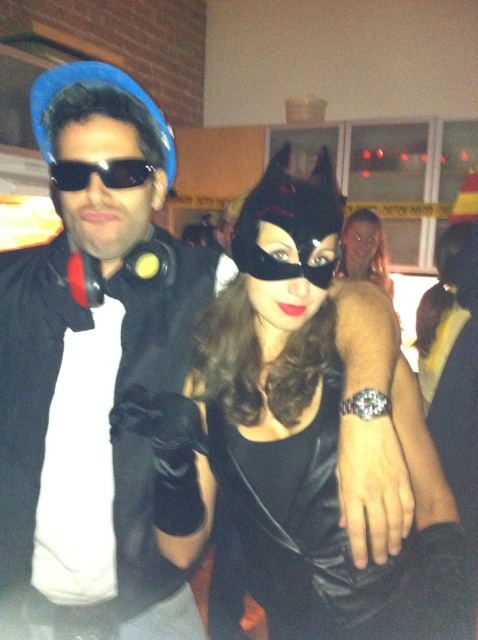
You are a photographer at a costume party. You need to arrange two props for a photo shoot. The matte black jacket at left and the black leather mask at center are already placed. Which prop is more to the left?

The matte black jacket at left is positioned on the left side of black leather mask at center, so the matte black jacket at left is more to the left.

You are organizing a costume party and need to arrange the matte black jacket at left and the black matte sunglasses at center on a shelf. Since the shelf can only hold items of equal width, will you need to adjust their placement?

The matte black jacket at left is wider than the black matte sunglasses at center, so they are not of equal width. Therefore, you will need to adjust their placement to ensure they fit properly on the shelf.